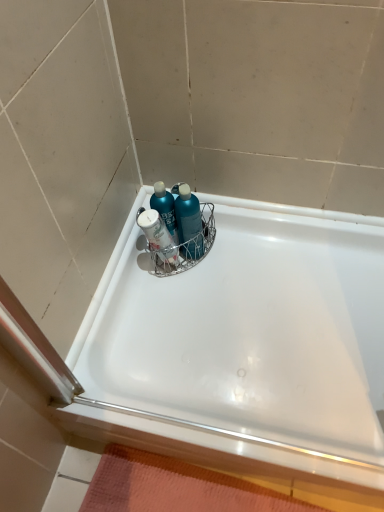
Image resolution: width=384 pixels, height=512 pixels. I want to click on vacant region to the left of teal glossy bottle at center, so click(132, 277).